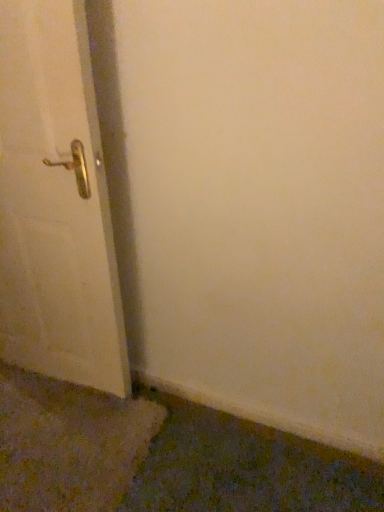
In order to face white glossy door at left, should I rotate leftwards or rightwards?

Turn left approximately 22.096 degrees to face it.

The image size is (384, 512). Describe the element at coordinates (55, 204) in the screenshot. I see `white glossy door at left` at that location.

At what (x,y) coordinates should I click in order to perform the action: click on white glossy door at left. Please return your answer as a coordinate pair (x, y). This screenshot has height=512, width=384. Looking at the image, I should click on (x=55, y=204).

Image resolution: width=384 pixels, height=512 pixels. Identify the location of white glossy door at left. (55, 204).